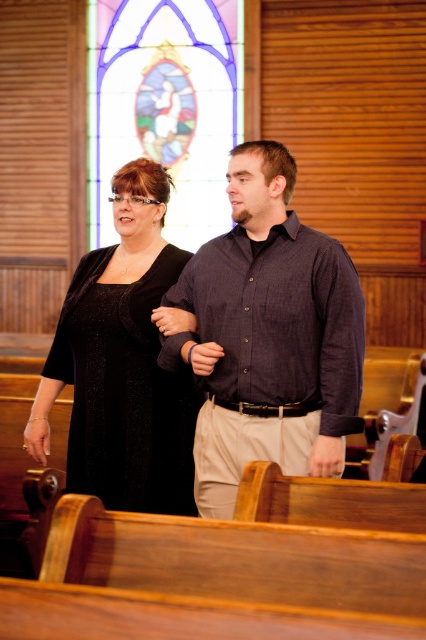
You are standing in a church and see the dark blue shirt at center and the stained glass window at upper center. Which object is located higher up in the image?

The stained glass window at upper center is located higher up than the dark blue shirt at center.

You are a photographer setting up for a wedding photo shoot in a church. You see a dark blue shirt at center and a black sparkly dress at center. Which clothing item is positioned to the right side of the other?

The dark blue shirt at center is positioned to the right of the black sparkly dress at center.

You are attending a wedding ceremony and notice the stained glass window at upper center and the black sparkly dress at center. Given that the dress is part of the bride or groom, which object is taller?

The stained glass window at upper center is taller than the black sparkly dress at center, so the stained glass window at upper center is taller.